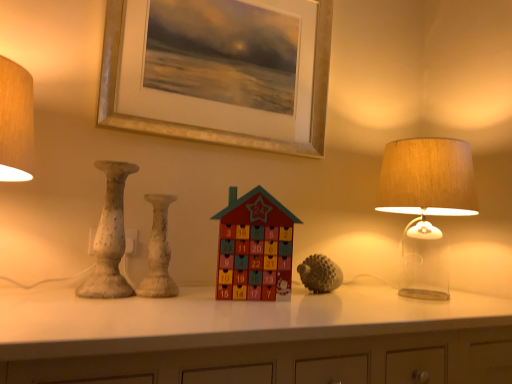
Question: Is textured gray hedgehog at center, the 2th toy viewed from the left, completely or partially inside white speckled vase at center, which appears as the second vase when viewed from the left?

Choices:
 (A) no
 (B) yes

Answer: (A)

Question: Does white speckled vase at center, placed as the first vase when sorted from right to left, have a lesser height compared to textured gray hedgehog at center, positioned as the second toy in front-to-back order?

Choices:
 (A) yes
 (B) no

Answer: (B)

Question: Is white speckled vase at center, which appears as the second vase when viewed from the left, positioned with its back to textured gray hedgehog at center, placed as the 1th toy when sorted from back to front?

Choices:
 (A) no
 (B) yes

Answer: (A)

Question: Is the position of white speckled vase at center, which appears as the second vase when viewed from the left, more distant than that of textured gray hedgehog at center, positioned as the first toy in right-to-left order?

Choices:
 (A) yes
 (B) no

Answer: (B)

Question: Is white speckled vase at center, which appears as the second vase when viewed from the left, completely or partially outside of textured gray hedgehog at center, positioned as the second toy in front-to-back order?

Choices:
 (A) no
 (B) yes

Answer: (B)

Question: From the image's perspective, is gold metallic picture frame at upper center located above or below translucent glass lampshade at right?

Choices:
 (A) above
 (B) below

Answer: (A)

Question: Based on their sizes in the image, would you say gold metallic picture frame at upper center is bigger or smaller than translucent glass lampshade at right?

Choices:
 (A) big
 (B) small

Answer: (B)

Question: Is gold metallic picture frame at upper center wider or thinner than translucent glass lampshade at right?

Choices:
 (A) thin
 (B) wide

Answer: (A)

Question: Is point (145, 130) closer or farther from the camera than point (418, 228)?

Choices:
 (A) farther
 (B) closer

Answer: (B)

Question: In the image, is wooden advent calendar at center, the second toy from the right, on the left side or the right side of textured gray hedgehog at center, positioned as the second toy in front-to-back order?

Choices:
 (A) left
 (B) right

Answer: (A)

Question: In the image, is wooden advent calendar at center, which is counted as the 1th toy, starting from the left, positioned in front of or behind textured gray hedgehog at center, positioned as the second toy in front-to-back order?

Choices:
 (A) front
 (B) behind

Answer: (A)

Question: Choose the correct answer: Is wooden advent calendar at center, which ranks as the second toy in back-to-front order, inside textured gray hedgehog at center, placed as the 1th toy when sorted from back to front, or outside it?

Choices:
 (A) inside
 (B) outside

Answer: (B)

Question: Considering the positions of point (268, 193) and point (333, 269), is point (268, 193) closer or farther from the camera than point (333, 269)?

Choices:
 (A) closer
 (B) farther

Answer: (B)

Question: From a real-world perspective, relative to translucent glass lampshade at right, is white speckled vase at center, which appears as the second vase when viewed from the left, vertically above or below?

Choices:
 (A) above
 (B) below

Answer: (B)

Question: From the image's perspective, is white speckled vase at center, which appears as the second vase when viewed from the left, located above or below translucent glass lampshade at right?

Choices:
 (A) above
 (B) below

Answer: (B)